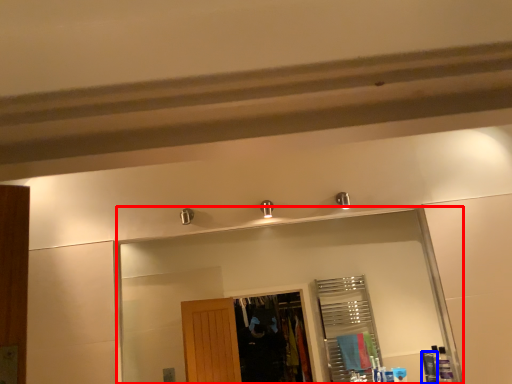
Question: Among these objects, which one is nearest to the camera, mirror (highlighted by a red box) or toiletry (highlighted by a blue box)?

Choices:
 (A) mirror
 (B) toiletry

Answer: (A)